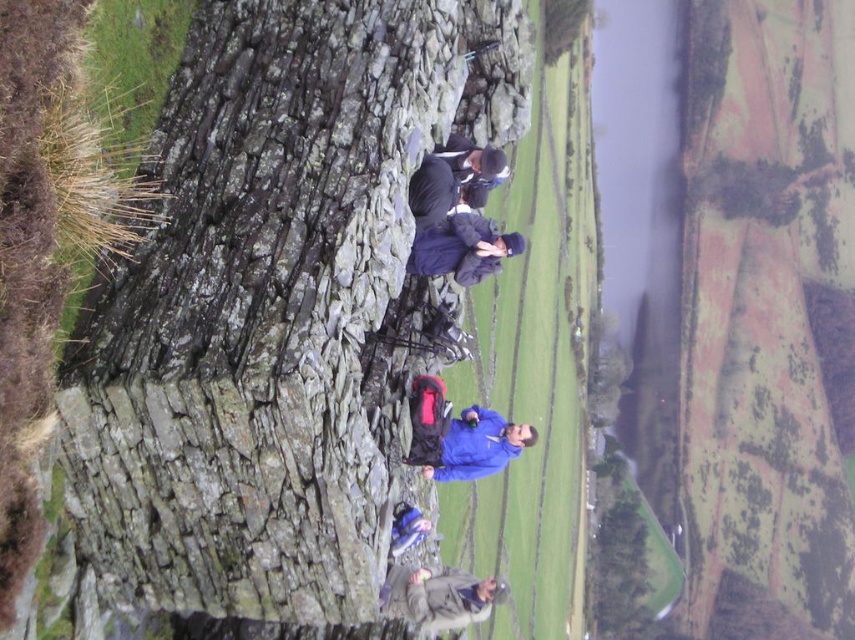
From the picture: You are planning to place a picnic blanket between the rough stone wall at center and the dark gray jacket at lower center. The blanket is 1.5 meters long. Will there be enough space for the blanket to fit between them?

The rough stone wall at center is 9.02 meters from the dark gray jacket at lower center. Since the blanket is only 1.5 meters long, there is more than enough space to place it between them.

You are planning to lean your backpack against the rough stone wall at center and the dark gray jacket at lower center. Which object can better support the backpack?

The rough stone wall at center can better support the backpack because it is larger in size compared to the dark gray jacket at lower center.